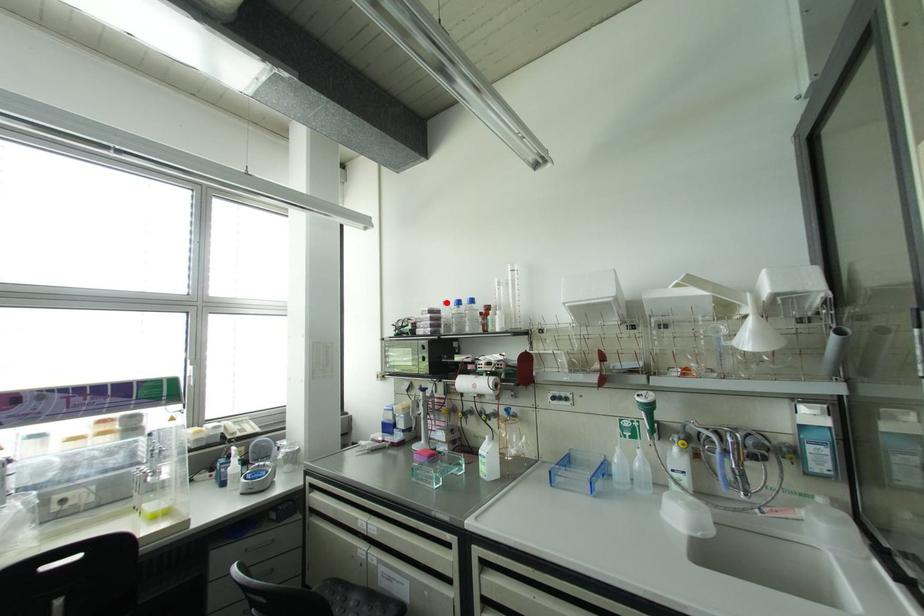
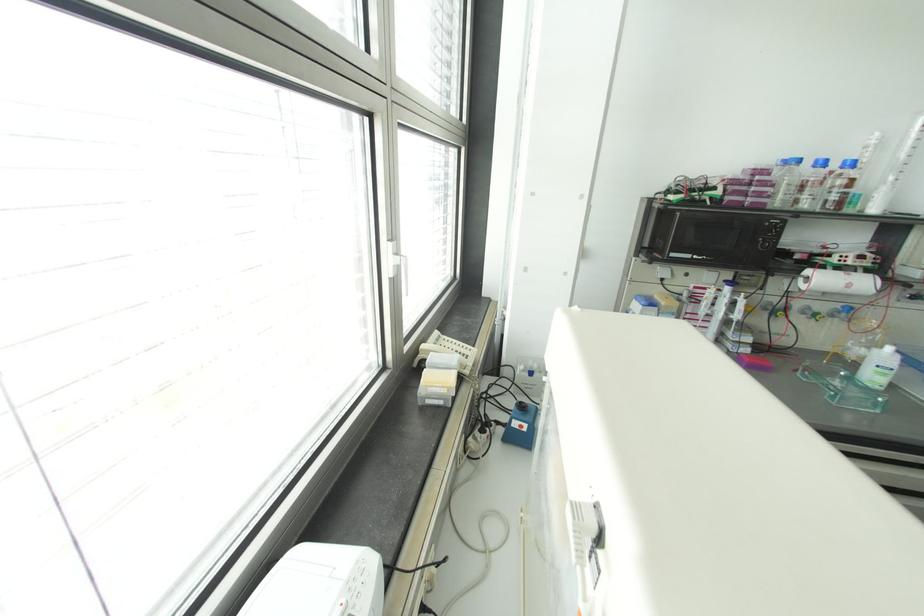
In the second image, find the point that corresponds to the highlighted location in the first image.

(797, 160)